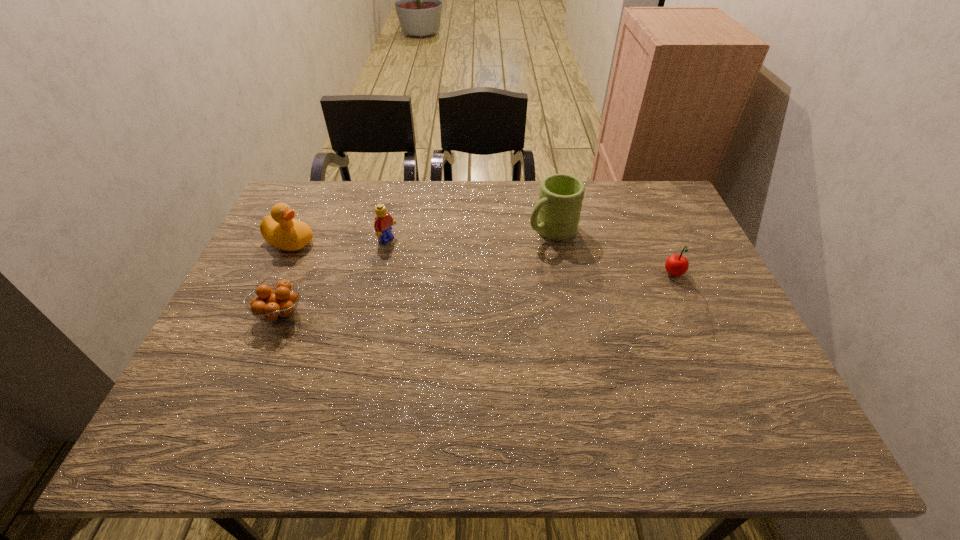
Find the location of a particular element. vacant space located 0.190m on the front-facing side of the Lego is located at coordinates [446, 271].

The width and height of the screenshot is (960, 540). In order to click on free space located 0.150m on the front-facing side of the Lego in this screenshot , I will do `click(435, 265)`.

At what (x,y) coordinates should I click in order to perform the action: click on free space located 0.370m on the face of the duck. Please return your answer as a coordinate pair (x, y). Looking at the image, I should click on (421, 287).

I want to click on vacant space located on the face of the duck, so click(x=356, y=264).

The image size is (960, 540). Identify the location of free space located 0.390m on the face of the duck. (428, 289).

Identify the location of vacant space located 0.360m on the side of the mug with the handle. (438, 303).

This screenshot has width=960, height=540. Identify the location of vacant area situated on the side of the mug with the handle. (481, 275).

Where is `vacant space located 0.180m on the side of the mug with the handle`? vacant space located 0.180m on the side of the mug with the handle is located at coordinates (490, 270).

Where is `object that is at the far edge`? The image size is (960, 540). object that is at the far edge is located at coordinates click(x=556, y=215).

Where is `orange fruit that is positioned at the left edge`? The image size is (960, 540). orange fruit that is positioned at the left edge is located at coordinates (280, 304).